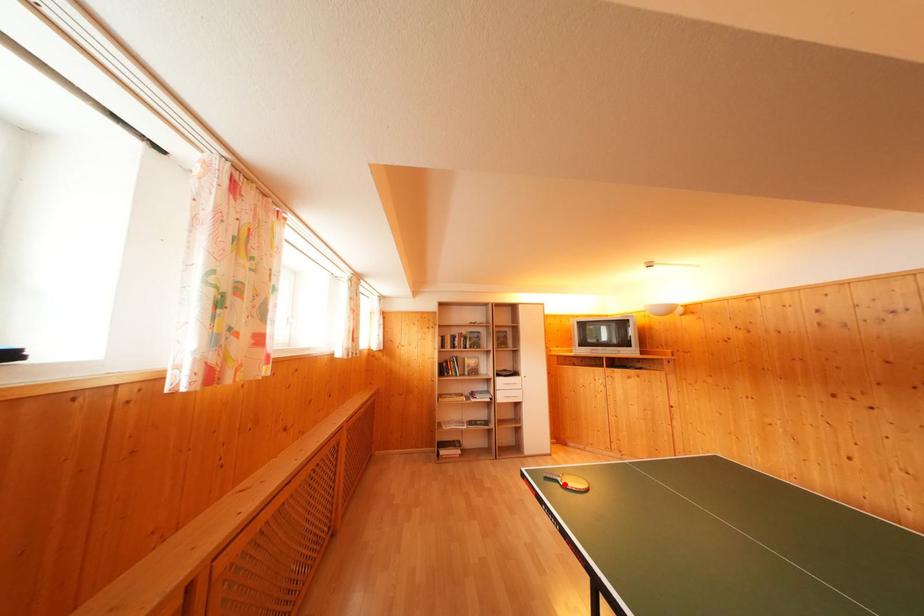
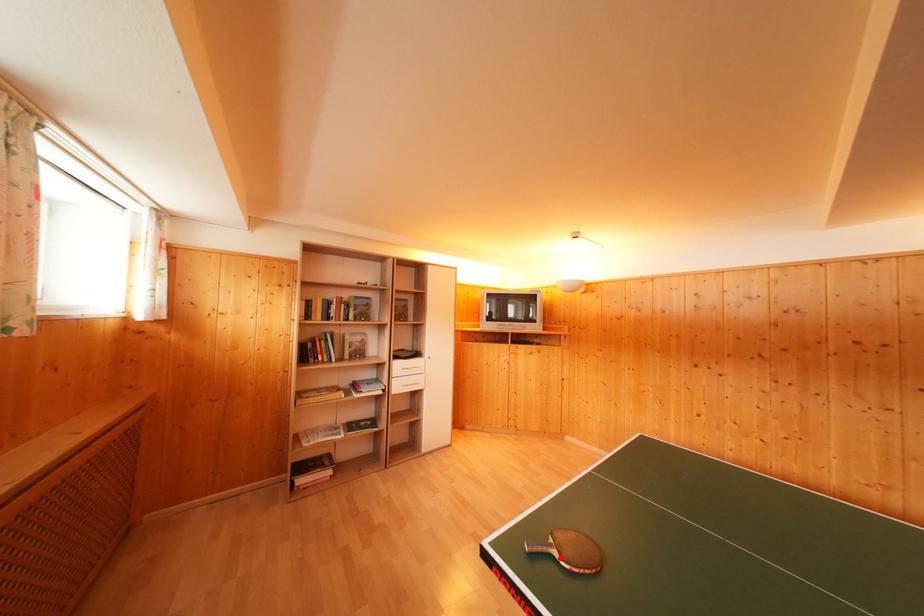
Consider the image. I am providing you with two images of the same scene from different viewpoints. A red point is marked on the first image and another point is marked on the second image. Is the red point in image1 aligned with the point shown in image2?

Yes